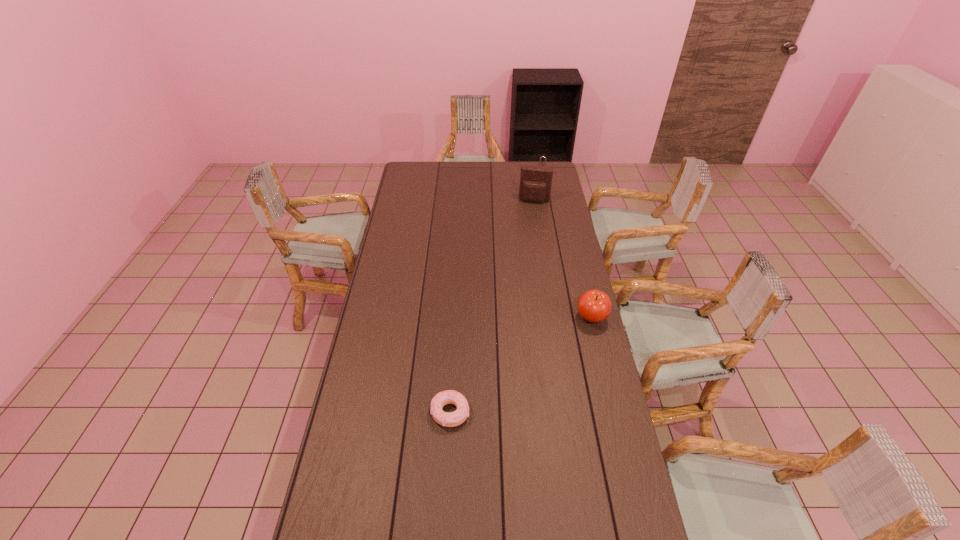
Find the location of a particular element. This screenshot has width=960, height=540. free space located 0.140m on the shackle of the padlock is located at coordinates (540, 192).

Identify the location of vacant space located 0.350m on the shackle of the padlock. The image size is (960, 540). (539, 214).

Locate an element on the screen. The width and height of the screenshot is (960, 540). vacant area situated 0.140m with an open flap on the pouch is located at coordinates (530, 220).

I want to click on vacant space situated with an open flap on the pouch, so click(x=526, y=239).

Locate an element on the screen. The width and height of the screenshot is (960, 540). free space located 0.330m with an open flap on the pouch is located at coordinates (526, 244).

Locate an element on the screen. object that is positioned at the far edge is located at coordinates (542, 156).

Locate an element on the screen. apple that is at the right edge is located at coordinates (594, 306).

This screenshot has height=540, width=960. Identify the location of padlock at the right edge. (542, 156).

Locate an element on the screen. This screenshot has width=960, height=540. pouch that is at the right edge is located at coordinates (535, 182).

Image resolution: width=960 pixels, height=540 pixels. What are the coordinates of `object located at the far right corner` in the screenshot? It's located at tap(542, 156).